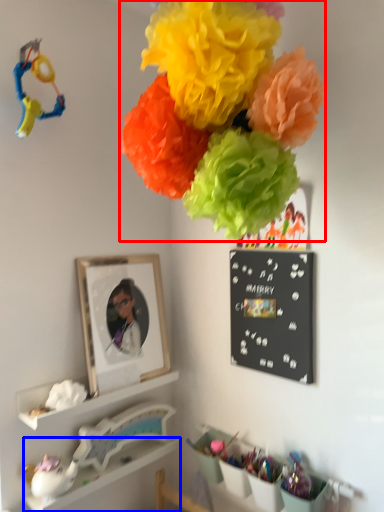
Question: Which of the following is the farthest to the observer, flower (highlighted by a red box) or shelf (highlighted by a blue box)?

Choices:
 (A) flower
 (B) shelf

Answer: (B)